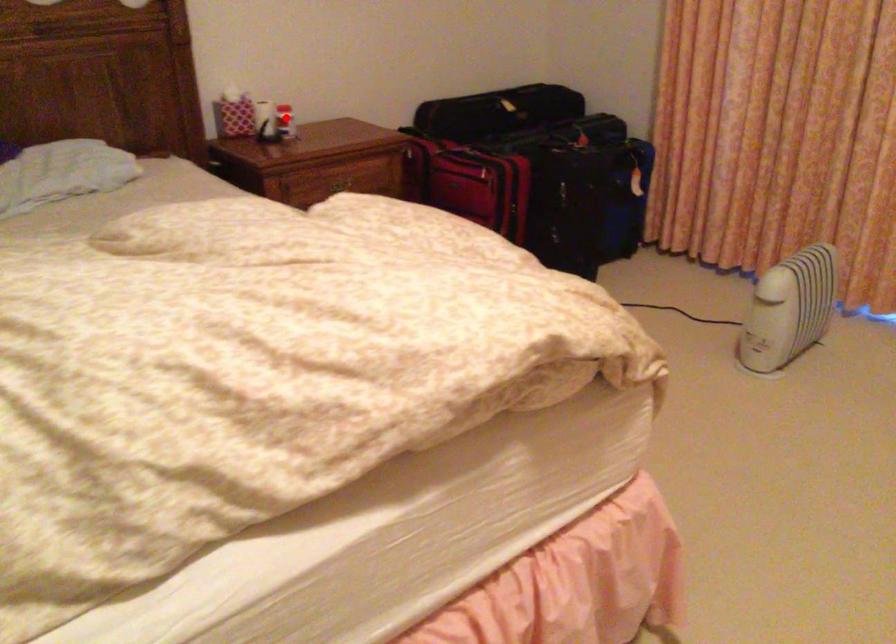
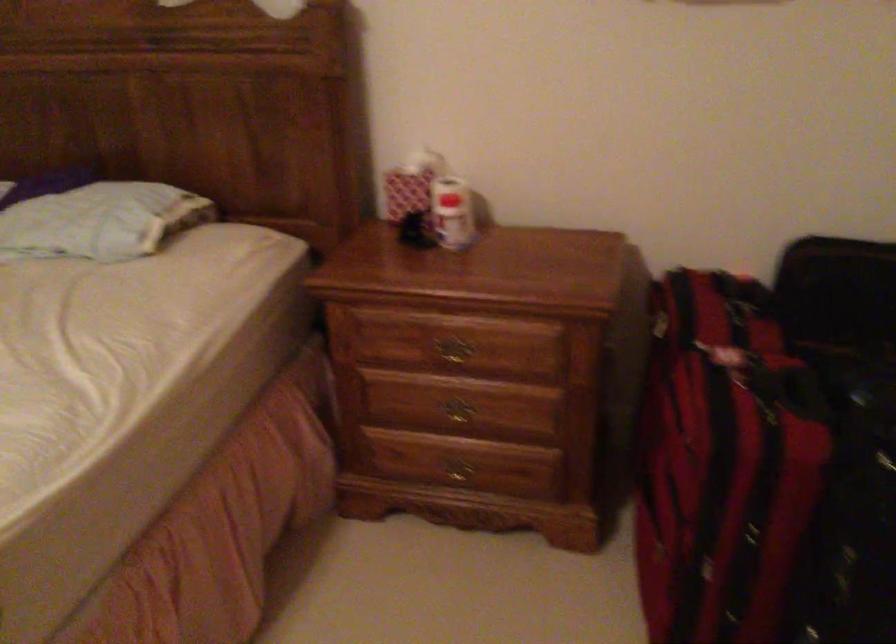
Where in the second image is the point corresponding to the highlighted location from the first image?

(452, 213)